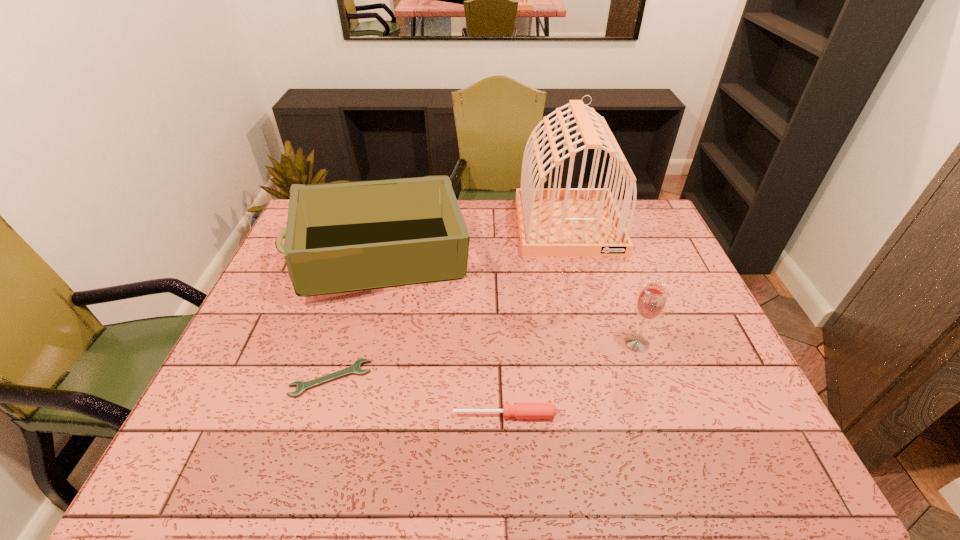
Identify the location of empty space between the box and the nearest object. (444, 337).

Find the location of a particular element. The height and width of the screenshot is (540, 960). empty space between the third nearest object and the shortest object is located at coordinates (484, 361).

The height and width of the screenshot is (540, 960). I want to click on object identified as the fourth closest to the nearest object, so click(553, 222).

Locate an element on the screen. The width and height of the screenshot is (960, 540). object that can be found as the fourth closest to the shortest object is located at coordinates (651, 301).

You are a GUI agent. You are given a task and a screenshot of the screen. Output one action in this format:
    pyautogui.click(x=<x>, y=<y>)
    Task: Click on the blank space that satisfies the following two spatial constraints: 1. with an open door on the wineglass; 2. on the left side of the tallest object
    The height and width of the screenshot is (540, 960).
    Given the screenshot: What is the action you would take?
    pyautogui.click(x=598, y=343)

Find the location of a particular element. vacant space that satisfies the following two spatial constraints: 1. with an open door on the third nearest object; 2. on the left side of the tallest object is located at coordinates (598, 343).